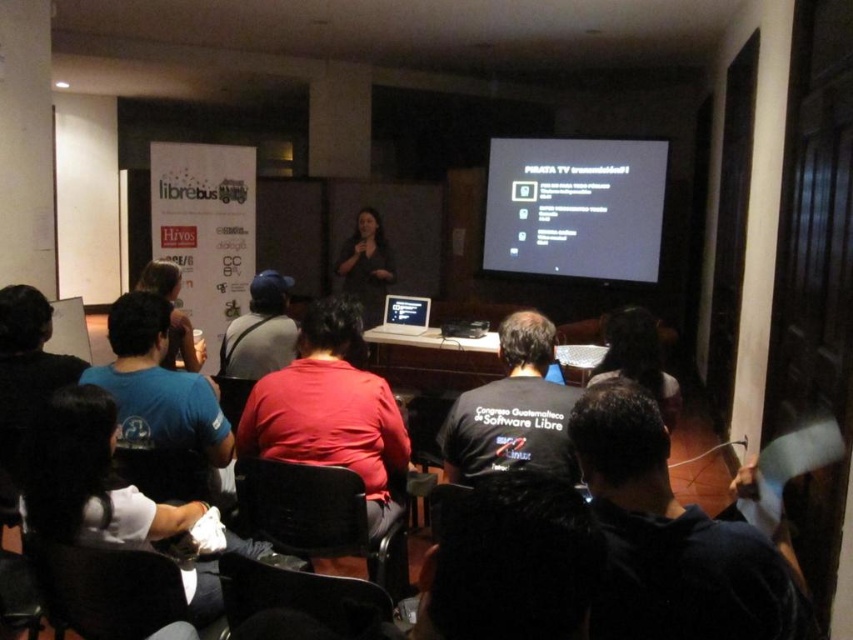
You are organizing a clothing donation drive and need to categorize shirts based on their sizes. You have two shirts in front of you, the white fabric shirt at lower center and the matte black shirt at center. Which shirt should you place in the small size bin?

The white fabric shirt at lower center has a smaller size compared to matte black shirt at center, so it should be placed in the small size bin.

You are organizing a clothing donation drive and need to categorize shirts by size. You have two shirts in front of you, the white fabric shirt at lower center and the matte black shirt at center. Based on their widths, which shirt would require a larger donation box?

The white fabric shirt at lower center requires a larger donation box because its width surpasses that of the matte black shirt at center.